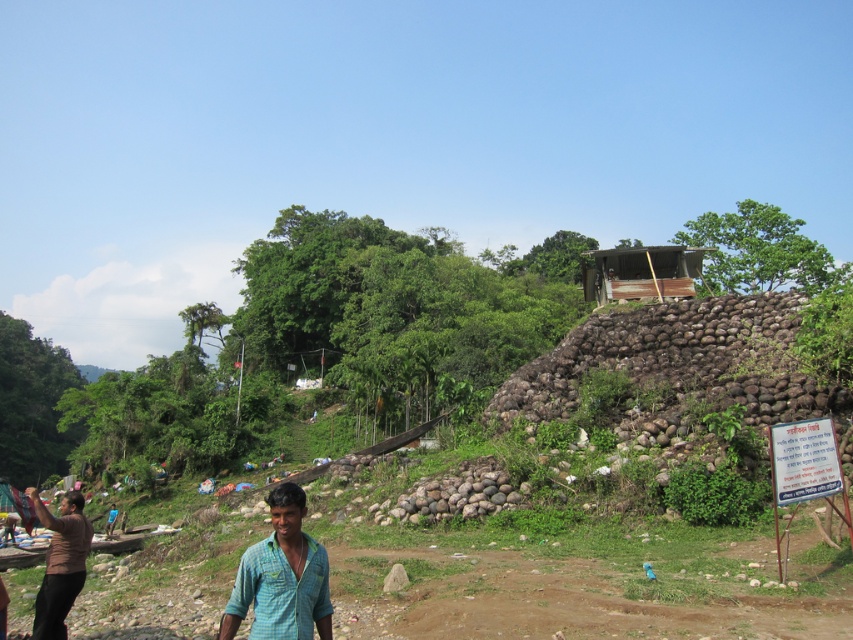
From the picture: You are standing at the dirt path leading to the stone mound shelter and notice two people wearing the green checkered shirt at lower center and the brown matte shirt at lower left. Which person is wearing a shorter shirt?

The green checkered shirt at lower center is shorter than the brown matte shirt at lower left, so the person wearing the green checkered shirt at lower center has the shorter shirt.